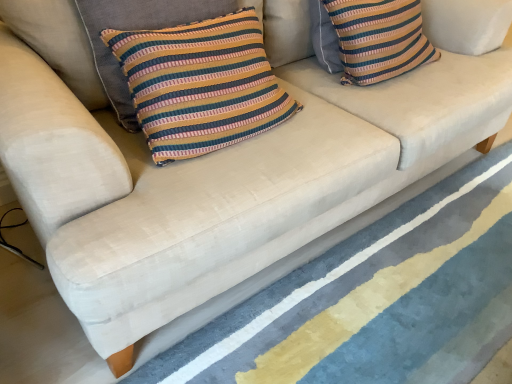
Question: From the image's perspective, does striped fabric pillow at upper right, marked as the second pillow in a front-to-back arrangement, appear higher than textured blue rug at lower center?

Choices:
 (A) no
 (B) yes

Answer: (B)

Question: Is striped fabric pillow at upper right, marked as the second pillow in a front-to-back arrangement, positioned far away from textured blue rug at lower center?

Choices:
 (A) no
 (B) yes

Answer: (A)

Question: Considering the relative sizes of striped fabric pillow at upper right, acting as the 2th pillow starting from the left, and textured blue rug at lower center in the image provided, is striped fabric pillow at upper right, acting as the 2th pillow starting from the left, smaller than textured blue rug at lower center?

Choices:
 (A) no
 (B) yes

Answer: (B)

Question: Is striped fabric pillow at upper right, marked as the second pillow in a front-to-back arrangement, taller than textured blue rug at lower center?

Choices:
 (A) yes
 (B) no

Answer: (A)

Question: Is striped fabric pillow at upper right, acting as the 2th pillow starting from the left, positioned with its back to textured blue rug at lower center?

Choices:
 (A) no
 (B) yes

Answer: (A)

Question: Is striped fabric pillow at center, the second pillow positioned from the right, wider or thinner than striped fabric pillow at upper right, arranged as the 1th pillow when viewed from the right?

Choices:
 (A) wide
 (B) thin

Answer: (B)

Question: In the image, is striped fabric pillow at center, the first pillow in the left-to-right sequence, positioned in front of or behind striped fabric pillow at upper right, the first pillow when ordered from back to front?

Choices:
 (A) front
 (B) behind

Answer: (A)

Question: From the image's perspective, is striped fabric pillow at center, the first pillow viewed from the front, positioned above or below striped fabric pillow at upper right, arranged as the 1th pillow when viewed from the right?

Choices:
 (A) above
 (B) below

Answer: (B)

Question: In terms of height, does striped fabric pillow at center, placed as the 2th pillow when sorted from back to front, look taller or shorter compared to striped fabric pillow at upper right, arranged as the 1th pillow when viewed from the right?

Choices:
 (A) short
 (B) tall

Answer: (B)

Question: From a real-world perspective, is textured blue rug at lower center above or below striped fabric pillow at center, the first pillow in the left-to-right sequence?

Choices:
 (A) above
 (B) below

Answer: (B)

Question: Is point (242, 322) closer or farther from the camera than point (182, 6)?

Choices:
 (A) farther
 (B) closer

Answer: (A)

Question: In terms of size, does textured blue rug at lower center appear bigger or smaller than striped fabric pillow at center, placed as the 2th pillow when sorted from back to front?

Choices:
 (A) big
 (B) small

Answer: (A)

Question: Is textured blue rug at lower center spatially inside striped fabric pillow at center, the first pillow viewed from the front, or outside of it?

Choices:
 (A) outside
 (B) inside

Answer: (A)

Question: Is striped fabric pillow at upper right, arranged as the 1th pillow when viewed from the right, taller or shorter than textured blue rug at lower center?

Choices:
 (A) short
 (B) tall

Answer: (B)

Question: From a real-world perspective, relative to textured blue rug at lower center, is striped fabric pillow at upper right, acting as the 2th pillow starting from the left, vertically above or below?

Choices:
 (A) above
 (B) below

Answer: (A)